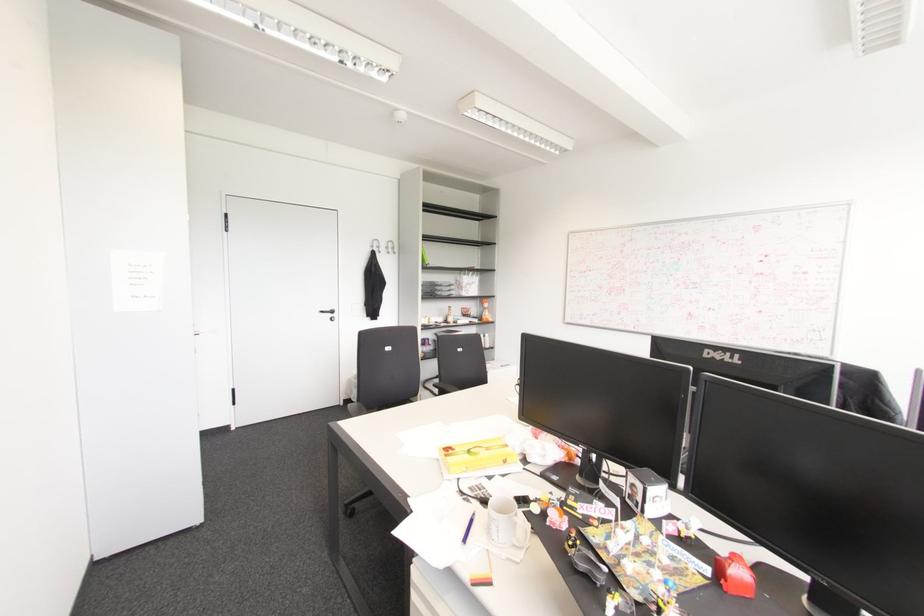
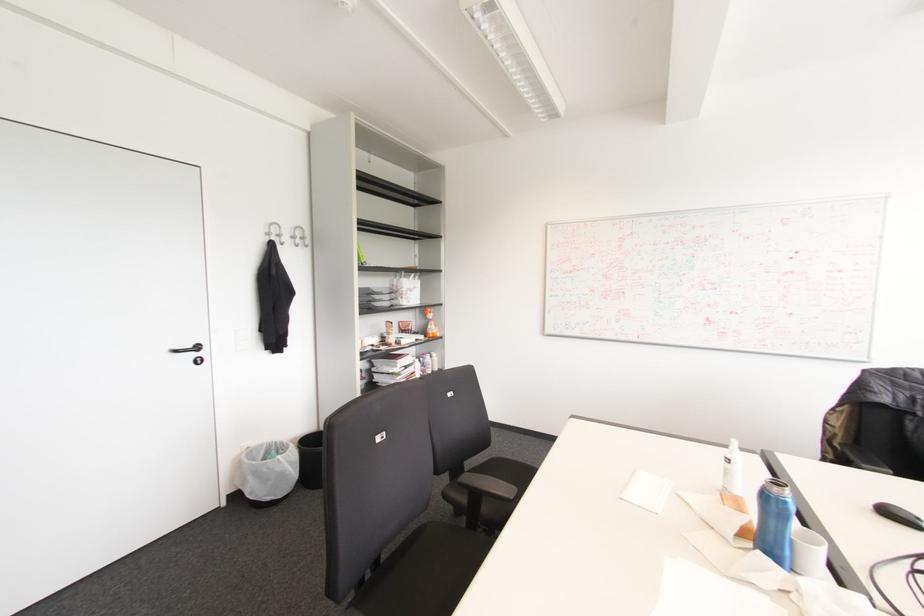
What movement of the cameraman would produce the second image?

The cameraman walked toward left, forward.